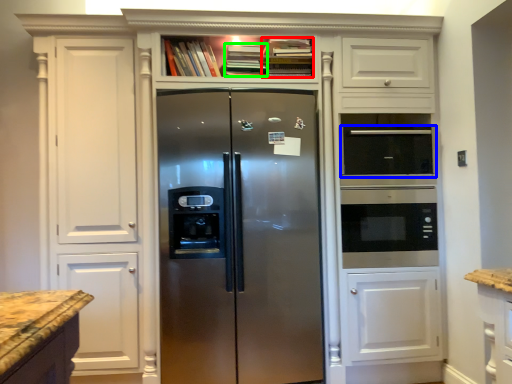
Question: Which object is positioned farthest from book (highlighted by a red box)? Select from appliance (highlighted by a blue box) and book (highlighted by a green box).

Choices:
 (A) appliance
 (B) book

Answer: (A)